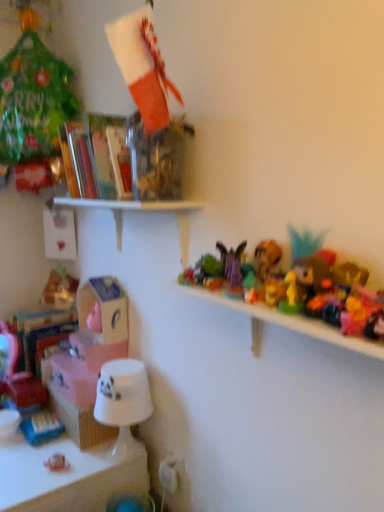
Where is `matte pink plush at left, which appears as the first toy when viewed from the back`? matte pink plush at left, which appears as the first toy when viewed from the back is located at coordinates (17, 373).

Image resolution: width=384 pixels, height=512 pixels. Find the location of `green matte toy at center, which is the third toy from left to right`. green matte toy at center, which is the third toy from left to right is located at coordinates (252, 288).

Locate an element on the screen. Image resolution: width=384 pixels, height=512 pixels. multicolored plastic toy at right, the third toy when ordered from back to front is located at coordinates (266, 258).

At what (x,y) coordinates should I click in order to perform the action: click on pink matte box at lower left, positioned as the 2th box in top-to-bottom order. Please return your answer as a coordinate pair (x, y). This screenshot has width=384, height=512. Looking at the image, I should click on (83, 366).

Considering the relative sizes of matte pink plush at left, arranged as the first toy when ordered from the bottom, and multicolored plastic toy at right, which is the fifth toy in left-to-right order, in the image provided, is matte pink plush at left, arranged as the first toy when ordered from the bottom, thinner than multicolored plastic toy at right, which is the fifth toy in left-to-right order,?

No, matte pink plush at left, arranged as the first toy when ordered from the bottom, is not thinner than multicolored plastic toy at right, which is the fifth toy in left-to-right order.

Is matte pink plush at left, which appears as the first toy when viewed from the back, completely or partially outside of multicolored plastic toy at right, the fifth toy from the bottom?

Indeed, matte pink plush at left, which appears as the first toy when viewed from the back, is completely outside multicolored plastic toy at right, the fifth toy from the bottom.

Is shiny plastic toy at center right, acting as the 1th toy starting from the front, in front of or behind matte pink plush at left, arranged as the 5th toy when viewed from the right, in the image?

Visually, shiny plastic toy at center right, acting as the 1th toy starting from the front, is located in front of matte pink plush at left, arranged as the 5th toy when viewed from the right.

Is shiny plastic toy at center right, marked as the 4th toy in a left-to-right arrangement, positioned beyond the bounds of matte pink plush at left, arranged as the 5th toy when viewed from the right?

That's correct, shiny plastic toy at center right, marked as the 4th toy in a left-to-right arrangement, is outside of matte pink plush at left, arranged as the 5th toy when viewed from the right.

Considering the points (280, 292) and (8, 357), which point is behind, point (280, 292) or point (8, 357)?

The point (8, 357) is behind.

What's the angular difference between shiny plastic toy at center right, the 5th toy in the back-to-front sequence, and matte pink plush at left, arranged as the fifth toy when viewed from the top,'s facing directions?

The angular difference between shiny plastic toy at center right, the 5th toy in the back-to-front sequence, and matte pink plush at left, arranged as the fifth toy when viewed from the top, is 24.7 degrees.

Locate an element on the screen. The width and height of the screenshot is (384, 512). table below the shiny plastic toy at center right, the 2th toy from the bottom (from the image's perspective) is located at coordinates (68, 475).

Which object is closer to the camera taking this photo, white glass table at lower left or shiny plastic toy at center right, the 2th toy from the bottom?

shiny plastic toy at center right, the 2th toy from the bottom, is closer to the camera.

Could you tell me if white glass table at lower left is facing shiny plastic toy at center right, marked as the 4th toy in a left-to-right arrangement?

No, white glass table at lower left is not oriented towards shiny plastic toy at center right, marked as the 4th toy in a left-to-right arrangement.

Consider the image. Is white glass table at lower left outside of shiny plastic toy at center right, acting as the 1th toy starting from the front?

Indeed, white glass table at lower left is completely outside shiny plastic toy at center right, acting as the 1th toy starting from the front.

Does point (95, 339) appear closer or farther from the camera than point (252, 282)?

Point (95, 339) is positioned farther from the camera compared to point (252, 282).

Is pink matte box at lower left, the 1th box in the bottom-to-top sequence, far away from green matte toy at center, which ranks as the 4th toy in back-to-front order?

pink matte box at lower left, the 1th box in the bottom-to-top sequence, is actually quite close to green matte toy at center, which ranks as the 4th toy in back-to-front order.

Is pink matte box at lower left, the 1th box in the bottom-to-top sequence, looking in the opposite direction of green matte toy at center, marked as the third toy in a right-to-left arrangement?

No, green matte toy at center, marked as the third toy in a right-to-left arrangement, is not at the back of pink matte box at lower left, the 1th box in the bottom-to-top sequence.

From the image's perspective, which is below, translucent plastic books at upper left, marked as the 3th shelf in a bottom-to-top arrangement, or white matte shelf at upper center, which is the second shelf from bottom to top?

white matte shelf at upper center, which is the second shelf from bottom to top, is shown below in the image.

Is translucent plastic books at upper left, which is the first shelf in top-to-bottom order, aimed at white matte shelf at upper center, which is the second shelf from bottom to top?

No, translucent plastic books at upper left, which is the first shelf in top-to-bottom order, is not turned towards white matte shelf at upper center, which is the second shelf from bottom to top.

Based on the photo, which is more to the right, translucent plastic books at upper left, which is the first shelf in top-to-bottom order, or white matte shelf at upper center, which is the second shelf from bottom to top?

white matte shelf at upper center, which is the second shelf from bottom to top.

Who is shorter, translucent plastic books at upper left, which is the first shelf in top-to-bottom order, or white matte shelf at upper center, which is the second shelf from bottom to top?

Standing shorter between the two is white matte shelf at upper center, which is the second shelf from bottom to top.

Can you confirm if white matte shelf at upper center, which is the second shelf from bottom to top, is positioned to the right of pink matte box at lower left, positioned as the 2th box in top-to-bottom order?

Yes, white matte shelf at upper center, which is the second shelf from bottom to top, is to the right of pink matte box at lower left, positioned as the 2th box in top-to-bottom order.

Is pink matte box at lower left, the 1th box in the bottom-to-top sequence, located within white matte shelf at upper center, placed as the 2th shelf when sorted from top to bottom?

No, pink matte box at lower left, the 1th box in the bottom-to-top sequence, is not inside white matte shelf at upper center, placed as the 2th shelf when sorted from top to bottom.

Are white matte shelf at upper center, which is the second shelf from bottom to top, and pink matte box at lower left, positioned as the 2th box in top-to-bottom order, located far from each other?

No, white matte shelf at upper center, which is the second shelf from bottom to top, is not far away from pink matte box at lower left, positioned as the 2th box in top-to-bottom order.

From a real-world perspective, is white matte shelf at upper center, which is the second shelf from bottom to top, above or below pink matte box at lower left, the 1th box in the bottom-to-top sequence?

From a real-world perspective, white matte shelf at upper center, which is the second shelf from bottom to top, is physically above pink matte box at lower left, the 1th box in the bottom-to-top sequence.

Considering the positions of points (114, 432) and (117, 314), is point (114, 432) farther from camera compared to point (117, 314)?

No, it is not.

Is white glossy cup at lower left, the first shelf when ordered from bottom to top, inside or outside of white cardboard box at center-left, the first box when ordered from top to bottom?

white glossy cup at lower left, the first shelf when ordered from bottom to top, lies outside white cardboard box at center-left, the first box when ordered from top to bottom.

Is white glossy cup at lower left, the first shelf when ordered from bottom to top, not near white cardboard box at center-left, which is the second box in bottom-to-top order?

No, white glossy cup at lower left, the first shelf when ordered from bottom to top, is not far away from white cardboard box at center-left, which is the second box in bottom-to-top order.

Who is taller, white glossy cup at lower left, the first shelf when ordered from bottom to top, or white cardboard box at center-left, the first box when ordered from top to bottom?

white cardboard box at center-left, the first box when ordered from top to bottom.

The width and height of the screenshot is (384, 512). I want to click on the 4th toy counting from the right of the matte pink plush at left, arranged as the 5th toy when viewed from the right, so click(266, 258).

Locate an element on the screen. This screenshot has width=384, height=512. toy below the shiny plastic toy at center right, the 5th toy in the back-to-front sequence (from the image's perspective) is located at coordinates (17, 373).

Considering their positions, is white matte shelf at upper center, placed as the 2th shelf when sorted from top to bottom, positioned further to white glossy lampshade at lower left than multicolored plastic toy at right, the first toy from the top?

multicolored plastic toy at right, the first toy from the top, is further to white glossy lampshade at lower left.

From the image, which object appears to be nearer to matte pink plush at left, the first toy viewed from the left, white matte shelf at upper center, which is the second shelf from bottom to top, or pink matte box at lower left, the 1th box in the bottom-to-top sequence?

The object closer to matte pink plush at left, the first toy viewed from the left, is pink matte box at lower left, the 1th box in the bottom-to-top sequence.

Looking at the image, which one is located further to white glossy lampshade at lower left, matte pink plush at left, placed as the 5th toy when sorted from front to back, or purple fabric butterfly at upper center, which ranks as the second toy in left-to-right order?

purple fabric butterfly at upper center, which ranks as the second toy in left-to-right order, is further to white glossy lampshade at lower left.

Based on their spatial positions, is white cardboard box at center-left, the first box when ordered from top to bottom, or white glossy lampshade at lower left closer to white matte shelf at upper center, which is the second shelf from bottom to top?

white cardboard box at center-left, the first box when ordered from top to bottom, lies closer to white matte shelf at upper center, which is the second shelf from bottom to top, than the other object.

Estimate the real-world distances between objects in this image. Which object is closer to white glass table at lower left, purple fabric butterfly at upper center, the 4th toy viewed from the front, or pink matte box at lower left, the 1th box in the bottom-to-top sequence?

pink matte box at lower left, the 1th box in the bottom-to-top sequence, is positioned closer to the anchor white glass table at lower left.

From the image, which object appears to be nearer to matte pink plush at left, which appears as the first toy when viewed from the back, white cardboard box at center-left, the first box when ordered from top to bottom, or white glass table at lower left?

white glass table at lower left.

In the scene shown: From the image, which object appears to be farther from pink matte box at lower left, the 1th box in the bottom-to-top sequence, white glossy lampshade at lower left or translucent plastic books at upper left, which is the first shelf in top-to-bottom order?

translucent plastic books at upper left, which is the first shelf in top-to-bottom order, lies further to pink matte box at lower left, the 1th box in the bottom-to-top sequence, than the other object.

Which object lies nearer to the anchor point white glass table at lower left, translucent plastic books at upper left, which is the first shelf in top-to-bottom order, or white glossy lampshade at lower left?

white glossy lampshade at lower left.

This screenshot has width=384, height=512. Identify the location of toy positioned between green matte toy at center, which ranks as the 4th toy in back-to-front order, and purple fabric butterfly at upper center, which ranks as the second toy in back-to-front order, from near to far. (266, 258).

Where is `lamp between white matte shelf at upper center, placed as the 2th shelf when sorted from top to bottom, and white glass table at lower left vertically`? This screenshot has height=512, width=384. lamp between white matte shelf at upper center, placed as the 2th shelf when sorted from top to bottom, and white glass table at lower left vertically is located at coordinates (123, 400).

Identify the location of lamp between green matte toy at center, arranged as the 2th toy when viewed from the front, and white cardboard box at center-left, the first box when ordered from top to bottom, along the z-axis. (123, 400).

You are a GUI agent. You are given a task and a screenshot of the screen. Output one action in this format:
    pyautogui.click(x=<x>, y=<y>)
    Task: Click on the table between matte pink plush at left, arranged as the first toy when ordered from the bottom, and multicolored plastic toy at right, marked as the first toy in a right-to-left arrangement
    
    Given the screenshot: What is the action you would take?
    pyautogui.click(x=68, y=475)